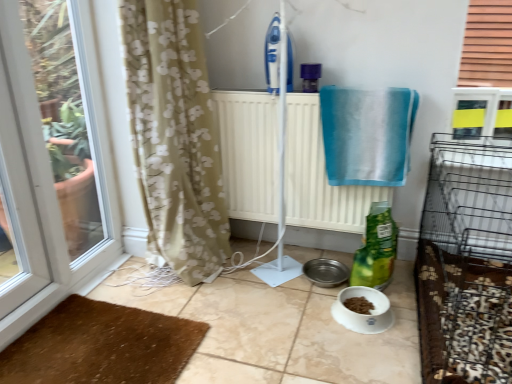
Question: From a real-world perspective, is blue fabric towel at upper right under green matte bag at lower center?

Choices:
 (A) yes
 (B) no

Answer: (B)

Question: Can you confirm if blue fabric towel at upper right is shorter than green matte bag at lower center?

Choices:
 (A) no
 (B) yes

Answer: (A)

Question: Considering the relative positions of blue fabric towel at upper right and green matte bag at lower center in the image provided, is blue fabric towel at upper right behind green matte bag at lower center?

Choices:
 (A) no
 (B) yes

Answer: (A)

Question: Is blue fabric towel at upper right thinner than green matte bag at lower center?

Choices:
 (A) no
 (B) yes

Answer: (A)

Question: Does blue fabric towel at upper right turn towards green matte bag at lower center?

Choices:
 (A) no
 (B) yes

Answer: (A)

Question: Is blue fabric towel at upper right to the left or to the right of transparent glass window at left in the image?

Choices:
 (A) right
 (B) left

Answer: (A)

Question: From the image's perspective, is blue fabric towel at upper right located above or below transparent glass window at left?

Choices:
 (A) below
 (B) above

Answer: (B)

Question: Do you think blue fabric towel at upper right is within transparent glass window at left, or outside of it?

Choices:
 (A) outside
 (B) inside

Answer: (A)

Question: From a real-world perspective, is blue fabric towel at upper right above or below transparent glass window at left?

Choices:
 (A) above
 (B) below

Answer: (A)

Question: In terms of height, does white radiator at center look taller or shorter compared to blue fabric towel at upper right?

Choices:
 (A) short
 (B) tall

Answer: (B)

Question: From the image's perspective, is white radiator at center above or below blue fabric towel at upper right?

Choices:
 (A) above
 (B) below

Answer: (B)

Question: From a real-world perspective, is white radiator at center physically located above or below blue fabric towel at upper right?

Choices:
 (A) above
 (B) below

Answer: (B)

Question: Choose the correct answer: Is white radiator at center inside blue fabric towel at upper right or outside it?

Choices:
 (A) outside
 (B) inside

Answer: (A)

Question: Is brown textured mat at lower left inside or outside of transparent glass window at left?

Choices:
 (A) inside
 (B) outside

Answer: (B)

Question: From a real-world perspective, is brown textured mat at lower left above or below transparent glass window at left?

Choices:
 (A) below
 (B) above

Answer: (A)